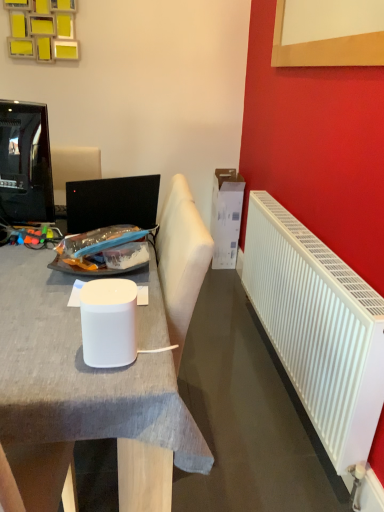
Question: Is white matte desk at center next to white glossy paper cup at center?

Choices:
 (A) no
 (B) yes

Answer: (A)

Question: Is white matte desk at center thinner than white glossy paper cup at center?

Choices:
 (A) no
 (B) yes

Answer: (A)

Question: Is white matte desk at center closer to camera compared to white glossy paper cup at center?

Choices:
 (A) no
 (B) yes

Answer: (A)

Question: Is white matte desk at center completely or partially outside of white glossy paper cup at center?

Choices:
 (A) no
 (B) yes

Answer: (B)

Question: From a real-world perspective, is white matte desk at center physically above white glossy paper cup at center?

Choices:
 (A) yes
 (B) no

Answer: (B)

Question: Does white matte desk at center have a larger size compared to white glossy paper cup at center?

Choices:
 (A) no
 (B) yes

Answer: (B)

Question: Considering the relative sizes of white cardboard box at upper right and white plastic radiator at right in the image provided, is white cardboard box at upper right wider than white plastic radiator at right?

Choices:
 (A) no
 (B) yes

Answer: (B)

Question: Is white cardboard box at upper right positioned in front of white plastic radiator at right?

Choices:
 (A) no
 (B) yes

Answer: (A)

Question: From the image's perspective, is white cardboard box at upper right on white plastic radiator at right?

Choices:
 (A) yes
 (B) no

Answer: (A)

Question: Can you confirm if white cardboard box at upper right is smaller than white plastic radiator at right?

Choices:
 (A) no
 (B) yes

Answer: (B)

Question: Considering the relative sizes of white cardboard box at upper right and white plastic radiator at right in the image provided, is white cardboard box at upper right shorter than white plastic radiator at right?

Choices:
 (A) no
 (B) yes

Answer: (A)

Question: Is white cardboard box at upper right located outside white plastic radiator at right?

Choices:
 (A) yes
 (B) no

Answer: (A)

Question: Is white glossy paper cup at center placed right next to white plastic radiator at right?

Choices:
 (A) no
 (B) yes

Answer: (A)